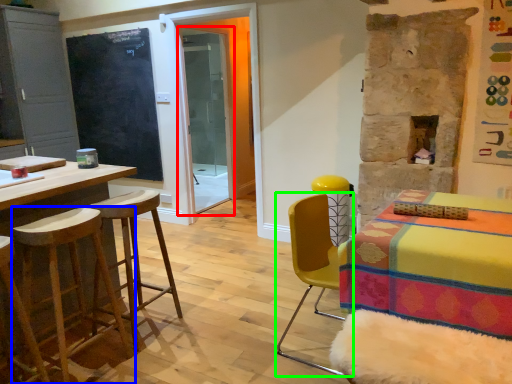
Question: Estimate the real-world distances between objects in this image. Which object is farther from screen door (highlighted by a red box), stool (highlighted by a blue box) or chair (highlighted by a green box)?

Choices:
 (A) stool
 (B) chair

Answer: (A)